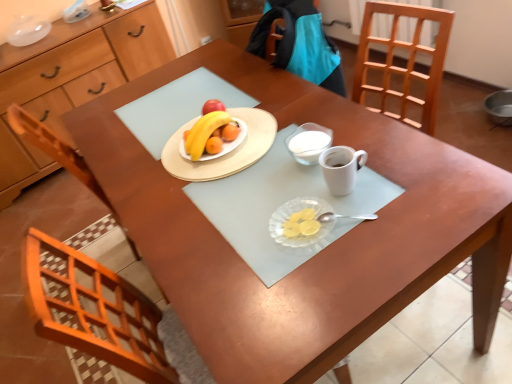
Find the location of a particular element. vacant location behind transparent glass plate at center is located at coordinates (269, 188).